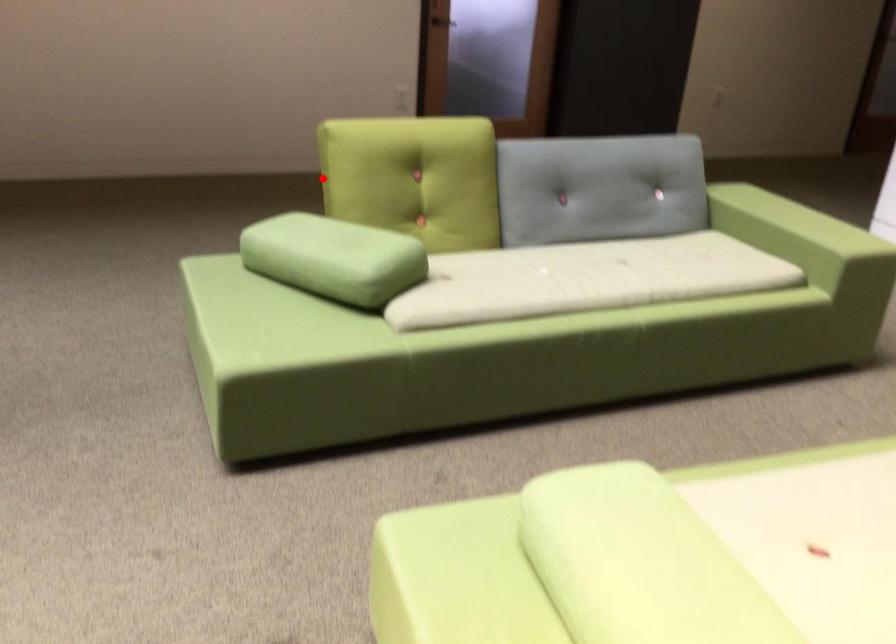
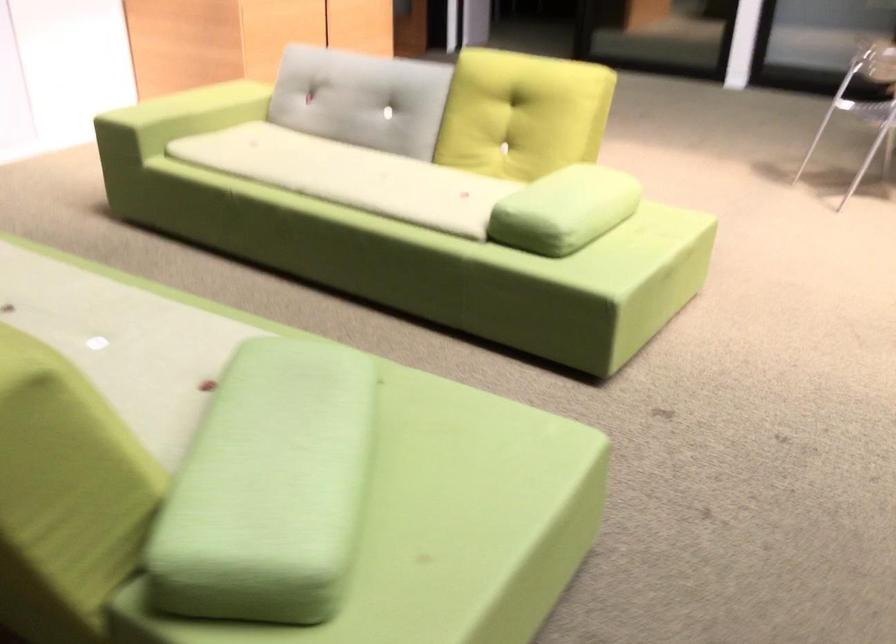
Question: A red point is marked in image1. In image2, is the corresponding 3D point closer to the camera or farther? Reply with the corresponding letter.

Choices:
 (A) The corresponding 3D point is closer.
 (B) The corresponding 3D point is farther.

Answer: (A)